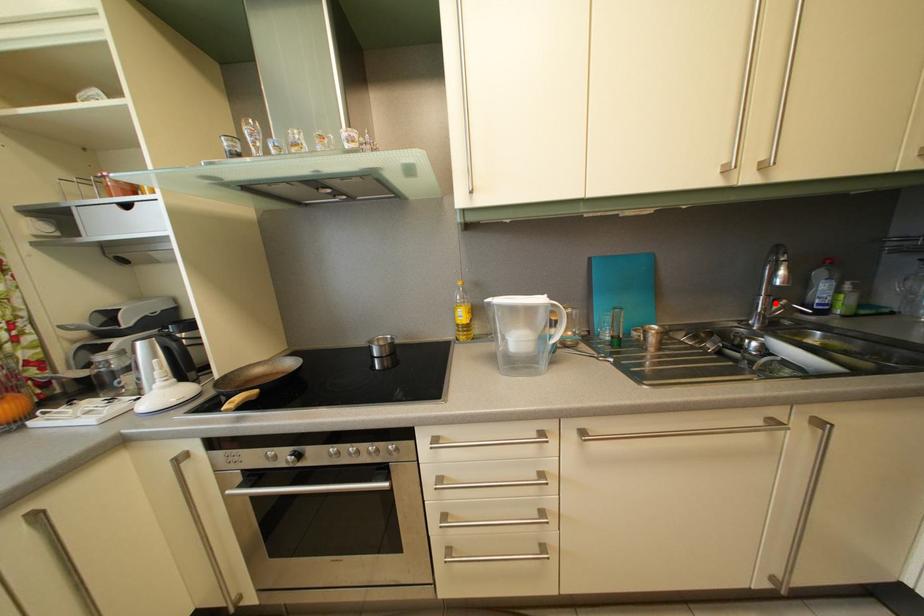
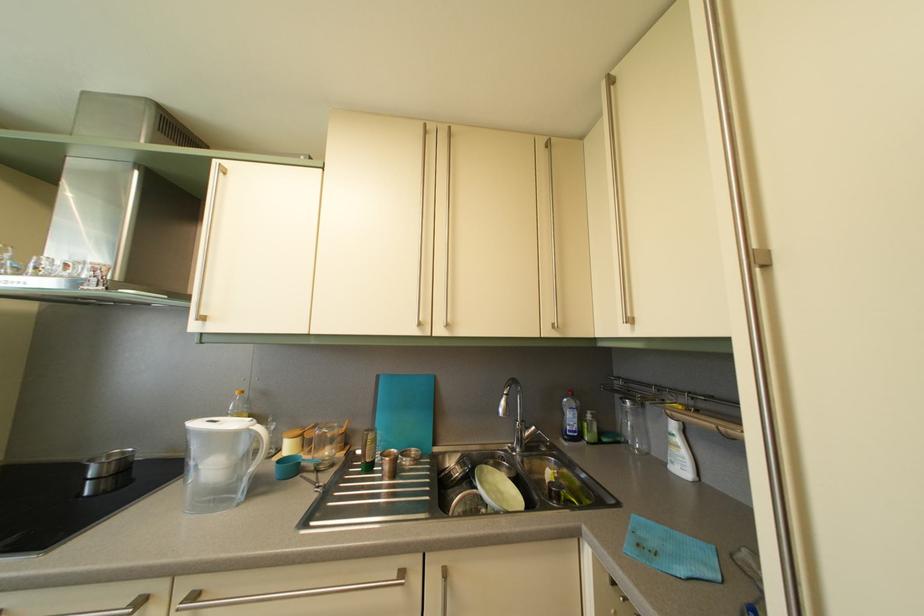
The point at the highlighted location is marked in the first image. Where is the corresponding point in the second image?

(530, 429)